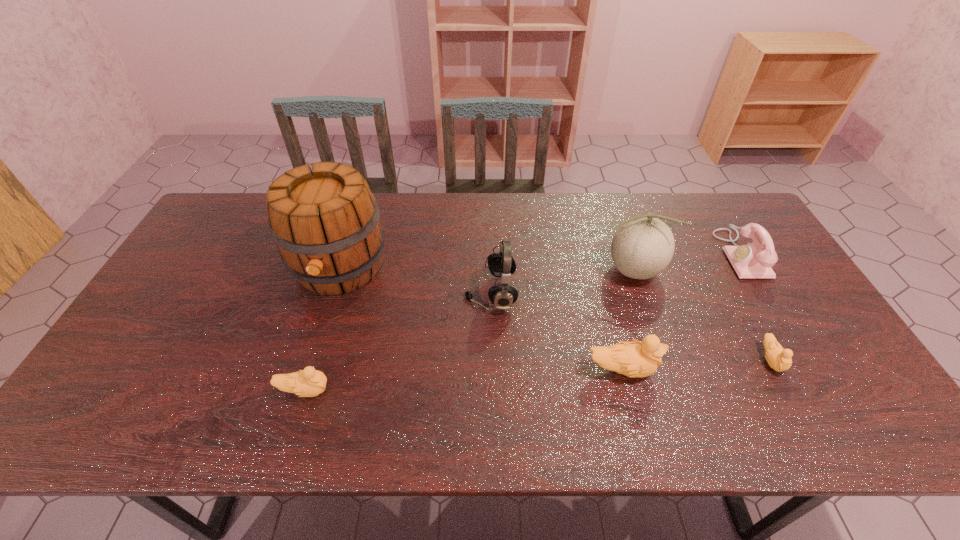
Locate an element on the screen. the second tallest duckling is located at coordinates (309, 382).

Identify the location of the second shortest object. (309, 382).

Find the location of a particular element. The width and height of the screenshot is (960, 540). the second duckling from left to right is located at coordinates (633, 359).

Image resolution: width=960 pixels, height=540 pixels. I want to click on the shortest object, so click(x=778, y=358).

Find the location of a particular element. This screenshot has height=540, width=960. the shortest duckling is located at coordinates (778, 358).

The image size is (960, 540). Identify the location of the fifth shortest object. (502, 265).

Find the location of a particular element. The image size is (960, 540). headset is located at coordinates (502, 265).

At what (x,y) coordinates should I click in order to perform the action: click on the tallest object. Please return your answer as a coordinate pair (x, y). This screenshot has width=960, height=540. Looking at the image, I should click on click(325, 221).

Where is `the rightmost object`? The height and width of the screenshot is (540, 960). the rightmost object is located at coordinates coord(754,260).

Where is `the second tallest object`? the second tallest object is located at coordinates (643, 246).